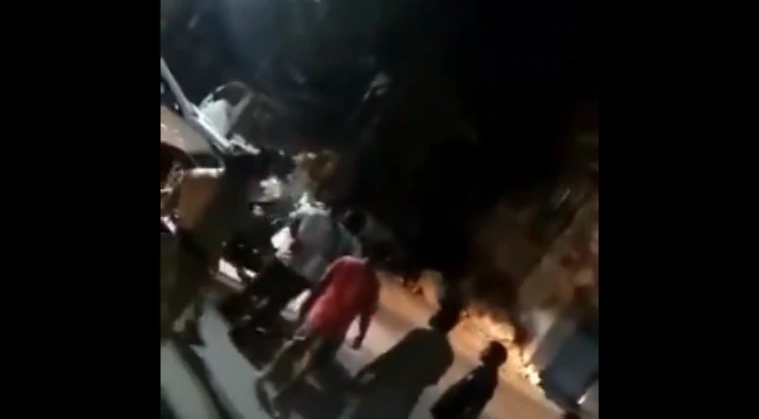
This screenshot has width=759, height=419. Identify the location of light. (518, 370).